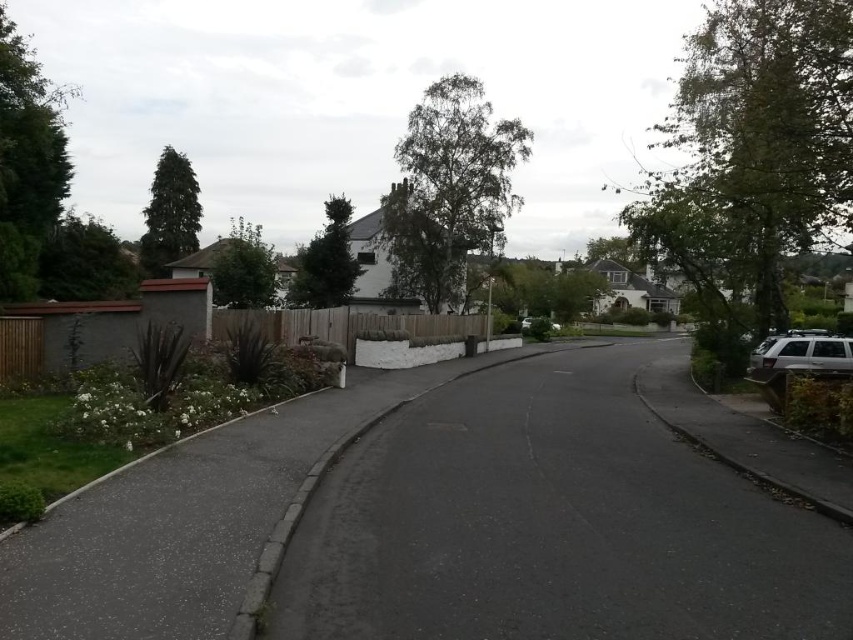
You are a pedestrian standing on the asphalt at lower left and want to walk towards the dark green leafy tree at center. Which direction should you move to reach it?

To reach the dark green leafy tree at center from the asphalt at lower left, you should move upward since the asphalt at lower left is located below the dark green leafy tree at center.